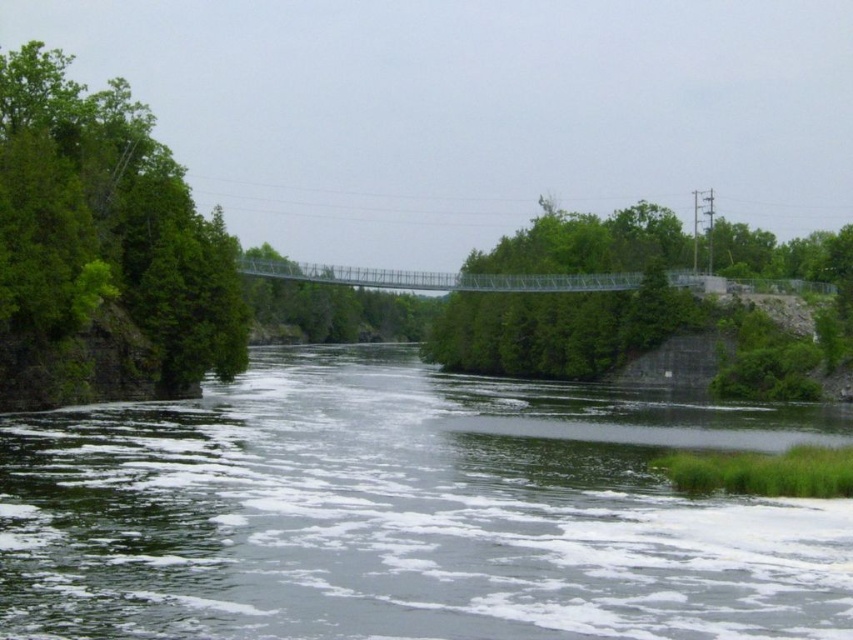
You are standing on the metal pedestrian bridge spanning the river. Looking down, you notice a specific point marked at coordinates point [408,513]. What color does the water appear at that point?

The water at point [408,513] is greenish gray.

You are standing on the metal pedestrian bridge and want to identify the direction of the river flow. Which tree, the green leafy tree at left or the green leafy tree at right, is closer to the upstream side of the bridge?

The green leafy tree at left is closer to the upstream side of the bridge because it is positioned to the left of the green leafy tree at right, and the river flows from upstream to downstream.